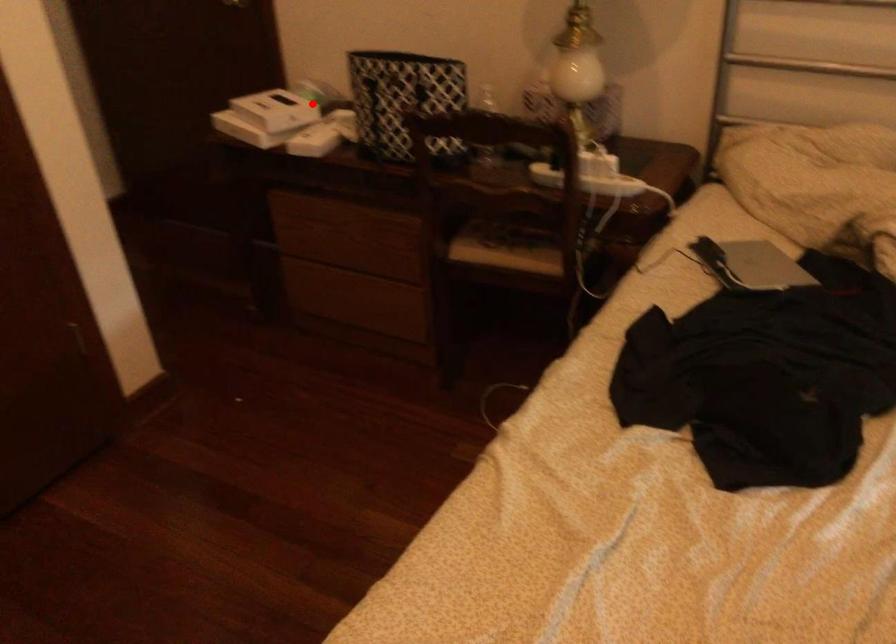
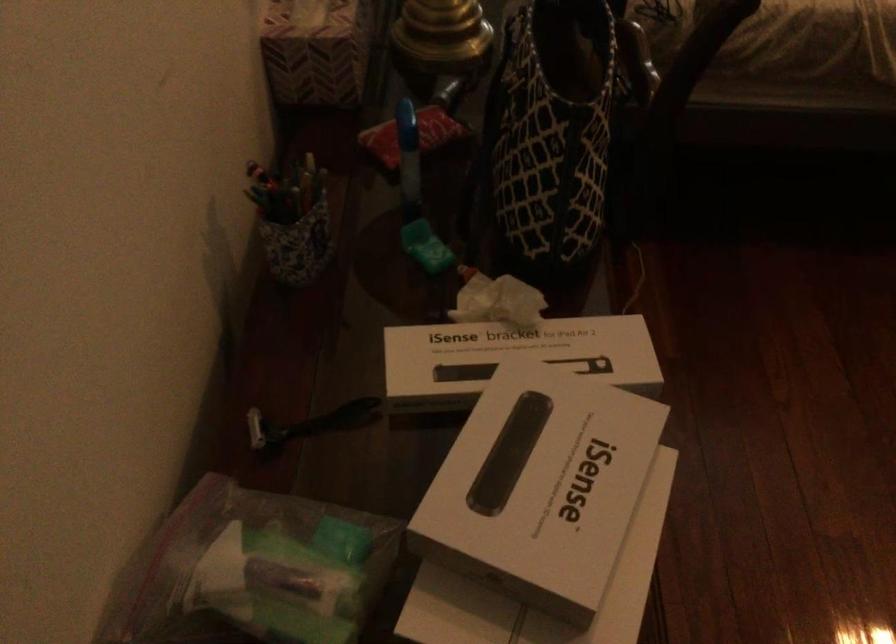
Question: I am providing you with two images of the same scene from different viewpoints. Image1 has a red point marked. In image2, the corresponding 3D location appears at what relative position? Reply with the corresponding letter.

Choices:
 (A) Closer
 (B) Farther

Answer: (A)